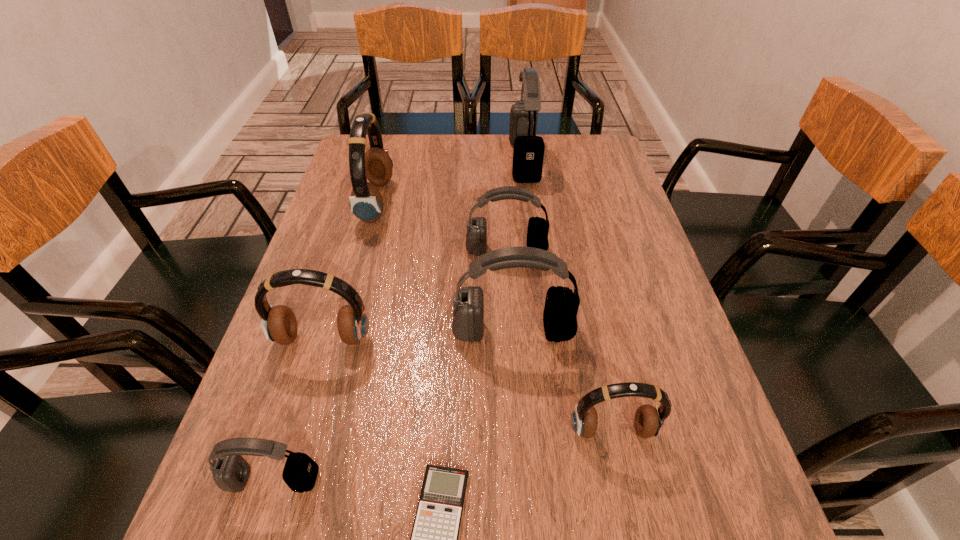
I want to click on vacant space at the far edge of the desktop, so click(x=483, y=140).

Locate an element on the screen. The width and height of the screenshot is (960, 540). free space at the near edge of the desktop is located at coordinates (626, 531).

This screenshot has height=540, width=960. In order to click on vacant area at the left edge in this screenshot , I will do `click(309, 258)`.

This screenshot has width=960, height=540. Identify the location of free spot at the right edge of the desktop. (615, 286).

Image resolution: width=960 pixels, height=540 pixels. Find the location of `vacant area at the near left corner of the desktop`. vacant area at the near left corner of the desktop is located at coordinates (197, 531).

In the image, there is a desktop. In order to click on free region at the far right corner in this screenshot , I will do `click(567, 139)`.

Find the location of a particular element. The width and height of the screenshot is (960, 540). empty location between the third nearest object and the second nearest brown headset is located at coordinates (468, 386).

Locate an element on the screen. The width and height of the screenshot is (960, 540). vacant area between the second nearest black headset and the farthest brown headset is located at coordinates pyautogui.click(x=444, y=266).

The width and height of the screenshot is (960, 540). I want to click on unoccupied area between the second smallest black headset and the second farthest brown headset, so pos(415,295).

Find the location of `vacant area that lies between the second biggest black headset and the smallest black headset`. vacant area that lies between the second biggest black headset and the smallest black headset is located at coordinates (393, 406).